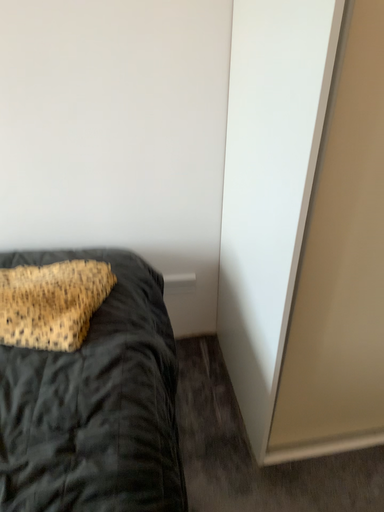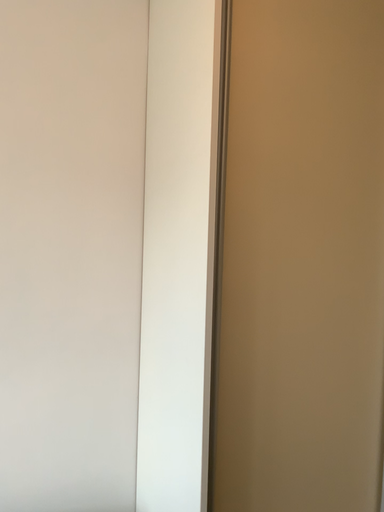
Question: How did the camera likely rotate when shooting the video?

Choices:
 (A) rotated downward
 (B) rotated upward

Answer: (B)